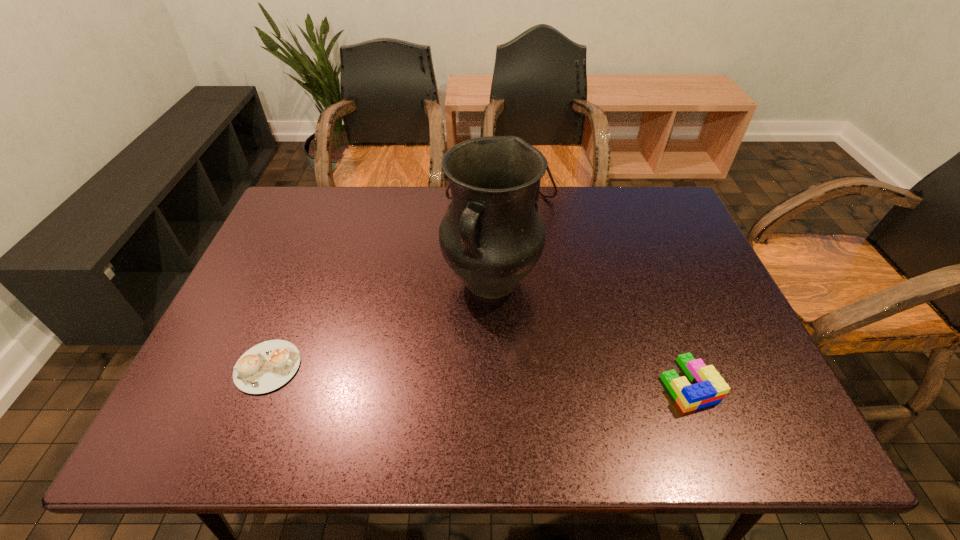
At what (x,y) coordinates should I click in order to perform the action: click on vacant space that is in between the cappuccino and the third nearest object. Please return your answer as a coordinate pair (x, y). The height and width of the screenshot is (540, 960). Looking at the image, I should click on (379, 324).

Locate an element on the screen. The width and height of the screenshot is (960, 540). empty space between the pitcher and the cappuccino is located at coordinates (379, 324).

You are a GUI agent. You are given a task and a screenshot of the screen. Output one action in this format:
    pyautogui.click(x=<x>, y=<y>)
    Task: Click on the unoccupied area between the Lego and the second tallest object
    
    Given the screenshot: What is the action you would take?
    pyautogui.click(x=594, y=290)

At what (x,y) coordinates should I click in order to perform the action: click on free space between the Lego and the second tallest object. Please return your answer as a coordinate pair (x, y). Image resolution: width=960 pixels, height=540 pixels. Looking at the image, I should click on (594, 290).

At what (x,y) coordinates should I click in order to perform the action: click on empty location between the rightmost object and the second farthest object. Please return your answer as a coordinate pair (x, y). The height and width of the screenshot is (540, 960). Looking at the image, I should click on (589, 333).

I want to click on vacant space that is in between the shoulder bag and the second shortest object, so [x=594, y=290].

In order to click on free space between the second shortest object and the shortest object in this screenshot , I will do `click(478, 375)`.

Image resolution: width=960 pixels, height=540 pixels. What are the coordinates of `vacant region between the cappuccino and the Lego` in the screenshot? It's located at (478, 375).

At what (x,y) coordinates should I click in order to perform the action: click on object that is the second closest one to the tallest object. Please return your answer as a coordinate pair (x, y). This screenshot has height=540, width=960. Looking at the image, I should click on (708, 388).

Select which object appears as the third closest to the pitcher. Please provide its 2D coordinates. Your answer should be formatted as a tuple, i.e. [(x, y)], where the tuple contains the x and y coordinates of a point satisfying the conditions above.

[(266, 366)]